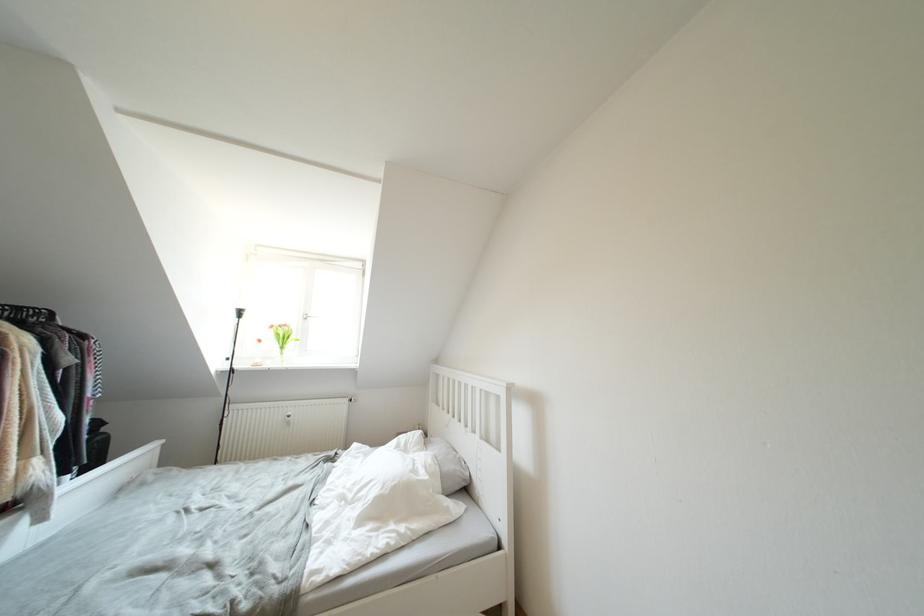
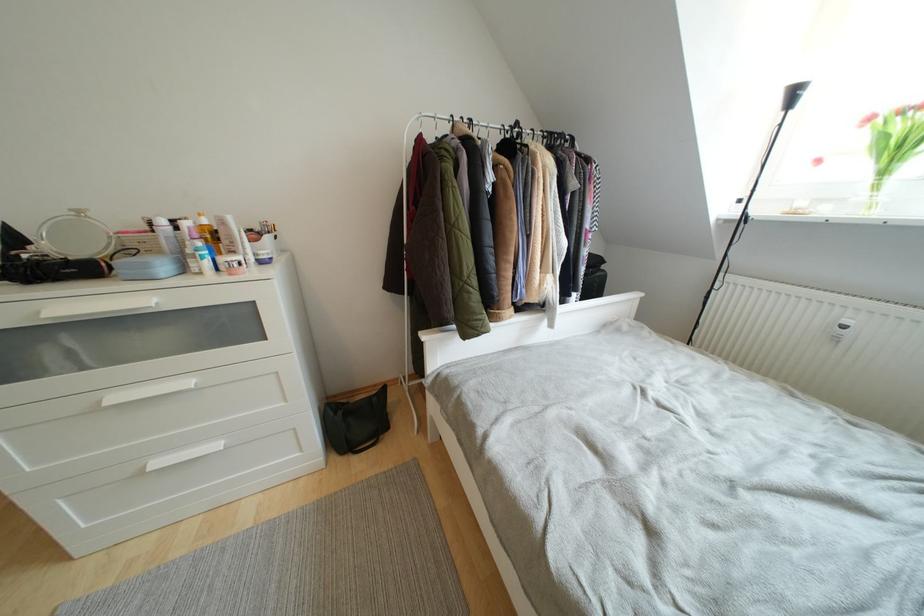
Find the pixel in the second image that matches (x=286, y=352) in the first image.

(890, 176)